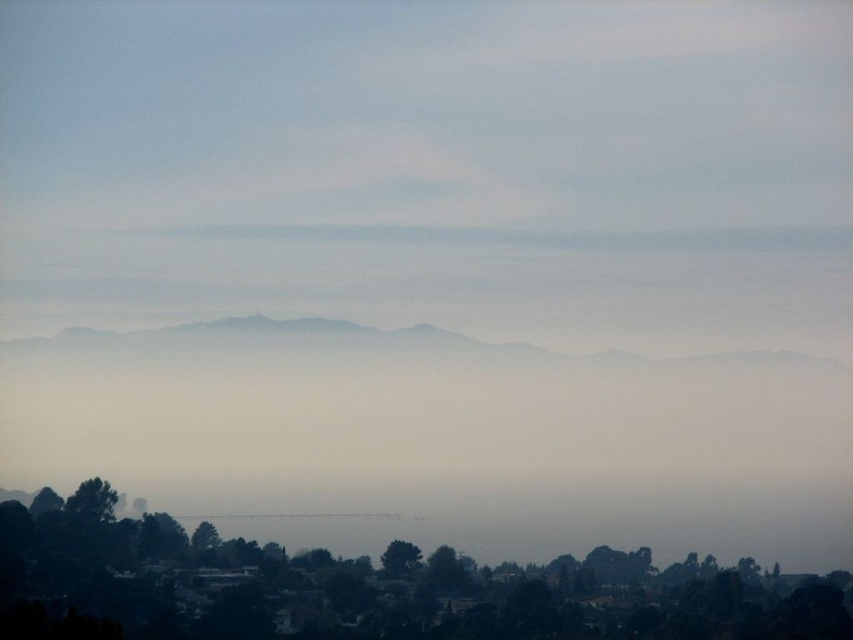
You are standing in the serene landscape and want to take a photo of the green matte tree at lower center and the green matte tree at center. Which tree should you focus on first to ensure both are in the frame?

The green matte tree at lower center is positioned under the green matte tree at center. Therefore, you should focus on the green matte tree at center first to ensure both are in the frame.

You are standing in the middle of the forest and see the green matte tree at lower center and the green matte tree at center. Which tree is taller?

The green matte tree at lower center is much taller than the green matte tree at center.